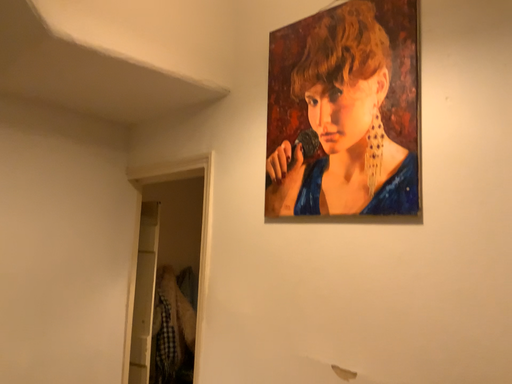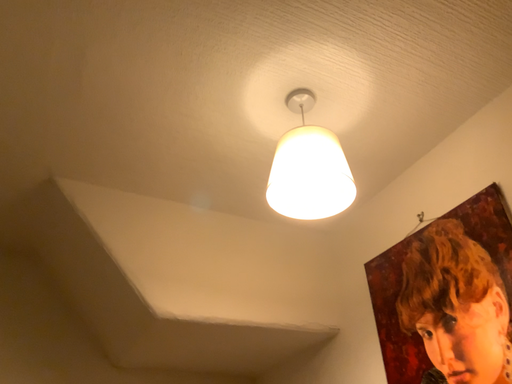
Question: Which way did the camera rotate in the video?

Choices:
 (A) rotated downward
 (B) rotated upward

Answer: (B)